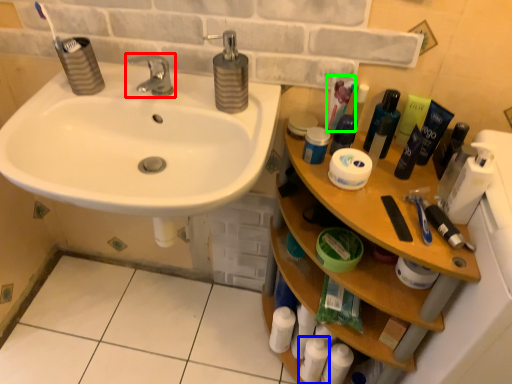
Question: Which is farther away from tap (highlighted by a red box)? toiletry (highlighted by a blue box) or toothpaste (highlighted by a green box)?

Choices:
 (A) toiletry
 (B) toothpaste

Answer: (A)